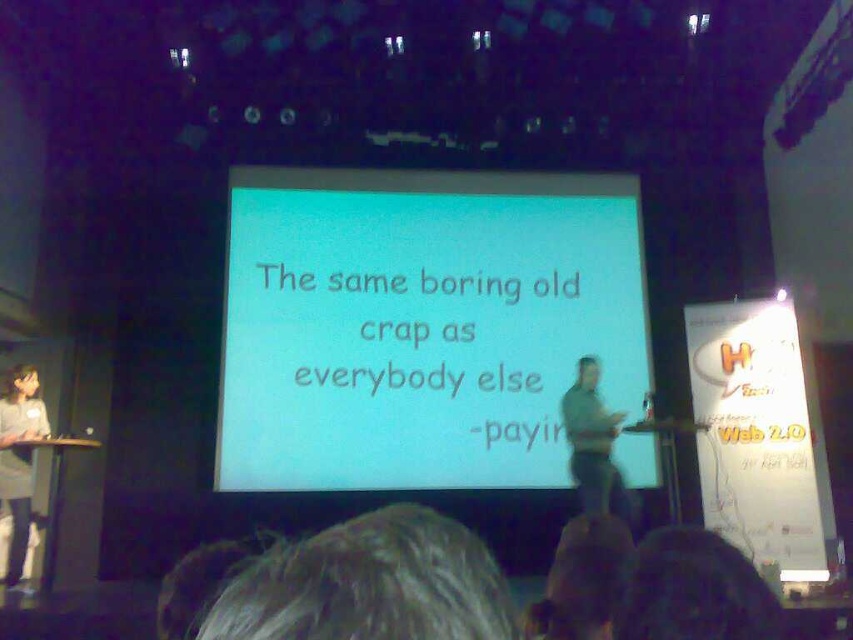
Question: Can you confirm if blonde hair at lower center is wider than gray fabric shirt at left?

Choices:
 (A) no
 (B) yes

Answer: (A)

Question: Which object is positioned closest to the gray fabric shirt at left?

Choices:
 (A) white matte projection screen at center
 (B) green fabric shirt at center

Answer: (A)

Question: Where is white matte projection screen at center located in relation to gray fabric shirt at left in the image?

Choices:
 (A) left
 (B) right

Answer: (B)

Question: Does blonde hair at lower center have a lesser width compared to gray fabric shirt at left?

Choices:
 (A) no
 (B) yes

Answer: (B)

Question: Which point is closer to the camera?

Choices:
 (A) (601, 416)
 (B) (364, 628)
 (C) (248, 300)

Answer: (B)

Question: Which point is closer to the camera?

Choices:
 (A) gray fabric shirt at left
 (B) blonde hair at lower center
 (C) green fabric shirt at center
 (D) white matte projection screen at center

Answer: (B)